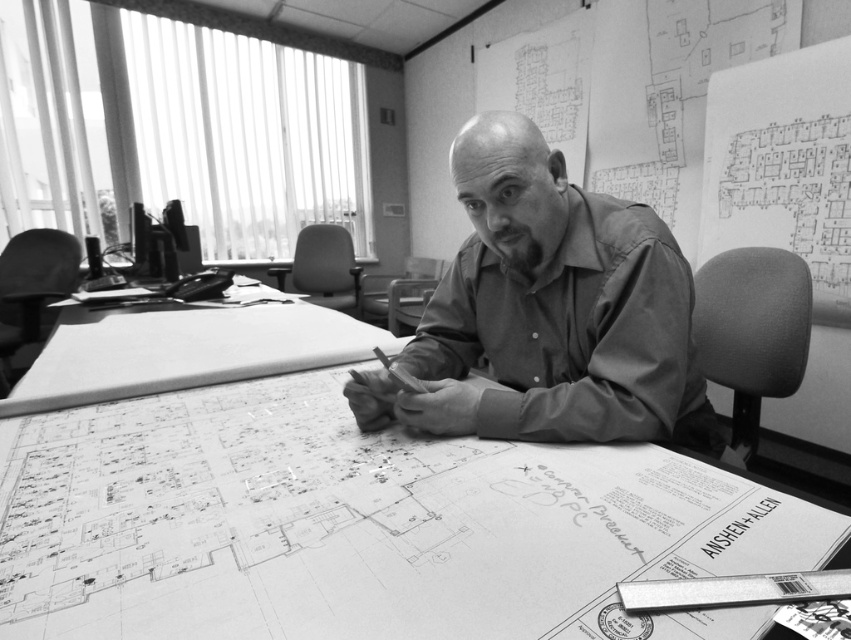
You are an office assistant who needs to place a new document on the desk. The desk has the white paper at center and the smooth shirt at center. Which object should you move to make space for the new document?

The smooth shirt at center should be moved because it is smaller in size compared to the white paper at center, making it easier to relocate to create space.

You are an office assistant who needs to place a new folder on the desk. The folder is taller than the white paper at center but shorter than the smooth shirt at center. Where should you place the folder on the desk?

The folder should be placed on the desk where it won not exceed the height of the smooth shirt at center, as the white paper at center is not as tall as the smooth shirt at center. Since the folder is taller than the white paper but shorter than the shirt, it can be placed anywhere on the desk as long as it doesn not surpass the shirt s height.